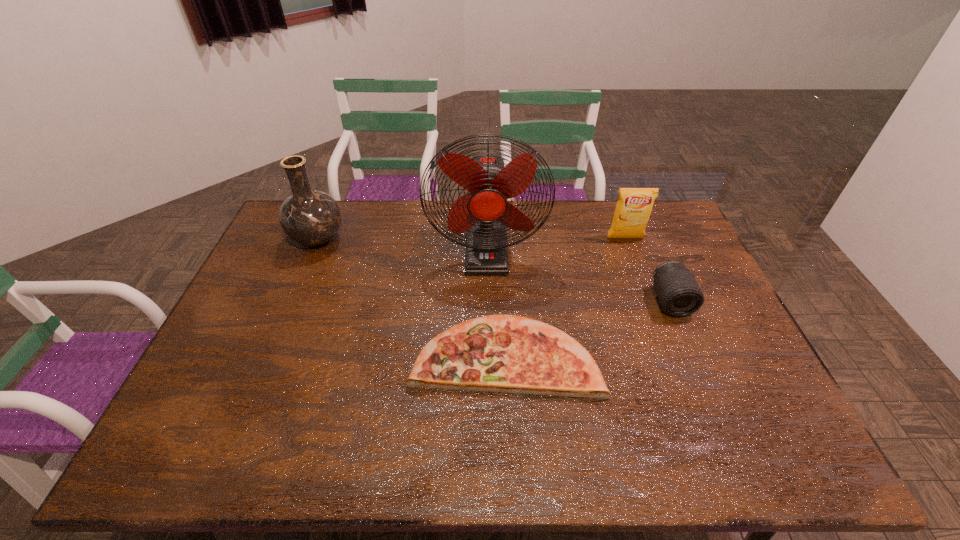
At what (x,y) coordinates should I click in order to perform the action: click on blank space located on the back of the pizza. Please return your answer as a coordinate pair (x, y). The image size is (960, 540). Looking at the image, I should click on (499, 246).

Where is `fan situated at the far edge`? fan situated at the far edge is located at coordinates (484, 213).

What are the coordinates of `vase present at the far edge` in the screenshot? It's located at (309, 217).

Find the location of `crisp (potato chip) that is at the far edge`. crisp (potato chip) that is at the far edge is located at coordinates (634, 206).

You are a GUI agent. You are given a task and a screenshot of the screen. Output one action in this format:
    pyautogui.click(x=<x>, y=<y>)
    Task: Click on the object located in the left edge section of the desktop
    
    Given the screenshot: What is the action you would take?
    pyautogui.click(x=309, y=217)

What are the coordinates of `crisp (potato chip) that is at the right edge` in the screenshot? It's located at (634, 206).

In order to click on telephoto lens that is at the right edge in this screenshot , I will do `click(679, 294)`.

Where is `object present at the far left corner`? The width and height of the screenshot is (960, 540). object present at the far left corner is located at coordinates (309, 217).

I want to click on object located at the far right corner, so click(x=634, y=206).

Where is `free location at the far edge`? The image size is (960, 540). free location at the far edge is located at coordinates (552, 211).